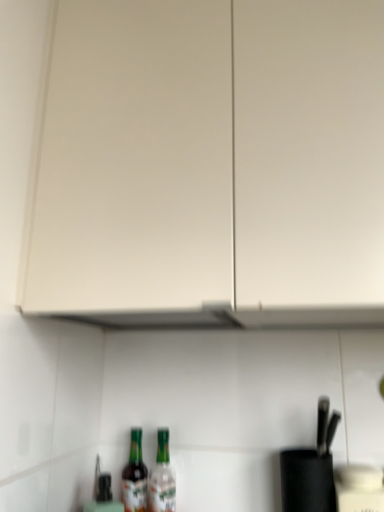
Question: Considering the relative sizes of translucent glass bottle at lower center, the first bottle in the right-to-left sequence, and white matte cabinet at upper center in the image provided, is translucent glass bottle at lower center, the first bottle in the right-to-left sequence, shorter than white matte cabinet at upper center?

Choices:
 (A) no
 (B) yes

Answer: (B)

Question: Can you confirm if translucent glass bottle at lower center, which is the second bottle from left to right, is thinner than white matte cabinet at upper center?

Choices:
 (A) no
 (B) yes

Answer: (B)

Question: Are translucent glass bottle at lower center, the first bottle in the right-to-left sequence, and white matte cabinet at upper center beside each other?

Choices:
 (A) no
 (B) yes

Answer: (A)

Question: Is translucent glass bottle at lower center, which is the second bottle from left to right, looking in the opposite direction of white matte cabinet at upper center?

Choices:
 (A) yes
 (B) no

Answer: (B)

Question: Is translucent glass bottle at lower center, which is the second bottle from left to right, further to camera compared to white matte cabinet at upper center?

Choices:
 (A) no
 (B) yes

Answer: (B)

Question: From a real-world perspective, is translucent glass bottle at lower center, which is the second bottle from left to right, located higher than white matte cabinet at upper center?

Choices:
 (A) yes
 (B) no

Answer: (B)

Question: Is the position of green glass bottle at lower center, which is the 1th bottle in left-to-right order, more distant than that of white matte cabinet at upper center?

Choices:
 (A) no
 (B) yes

Answer: (B)

Question: Is green glass bottle at lower center, which is the 1th bottle in left-to-right order, shorter than white matte cabinet at upper center?

Choices:
 (A) no
 (B) yes

Answer: (B)

Question: Is green glass bottle at lower center, which is the 1th bottle in left-to-right order, facing away from white matte cabinet at upper center?

Choices:
 (A) yes
 (B) no

Answer: (B)

Question: Is white matte cabinet at upper center a part of green glass bottle at lower center, which is the 1th bottle in left-to-right order?

Choices:
 (A) no
 (B) yes

Answer: (A)

Question: Does green glass bottle at lower center, the 2th bottle in the right-to-left sequence, have a greater height compared to white matte cabinet at upper center?

Choices:
 (A) no
 (B) yes

Answer: (A)

Question: From a real-world perspective, does green glass bottle at lower center, the 2th bottle in the right-to-left sequence, stand above white matte cabinet at upper center?

Choices:
 (A) no
 (B) yes

Answer: (A)

Question: Could you tell me if white matte cabinet at upper center is turned towards green glass bottle at lower center, the 2th bottle in the right-to-left sequence?

Choices:
 (A) no
 (B) yes

Answer: (A)